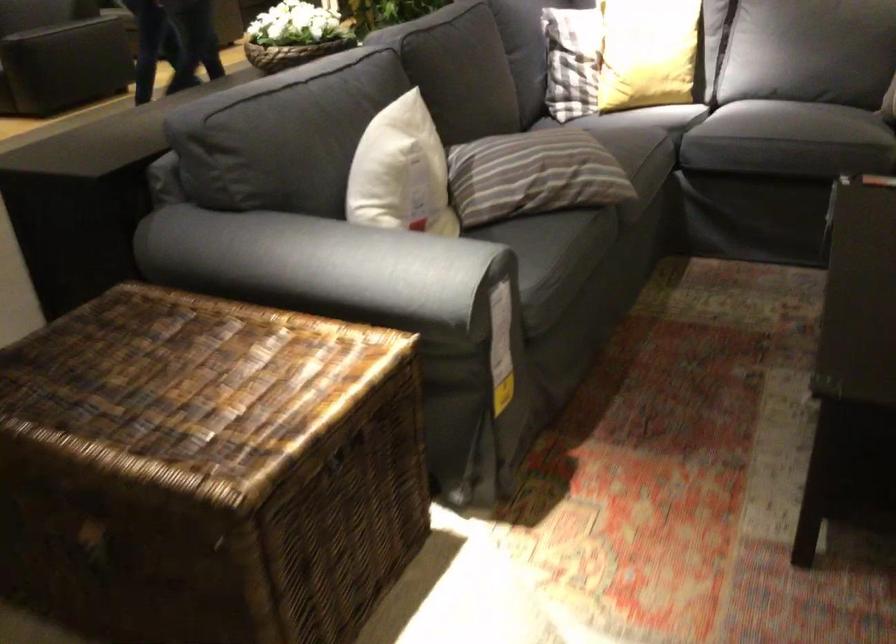
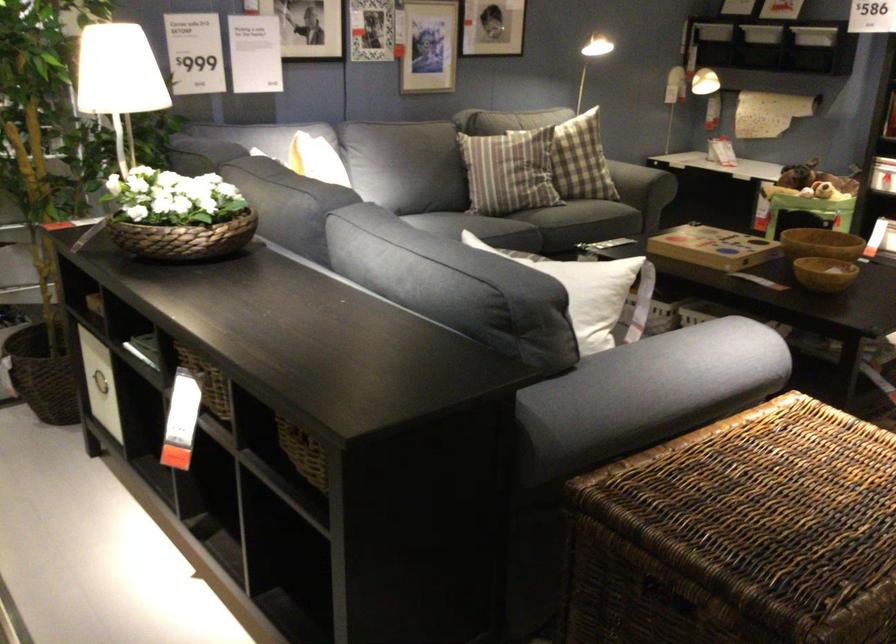
Find the pixel in the second image that matches the point at 754,97 in the first image.

(484, 227)